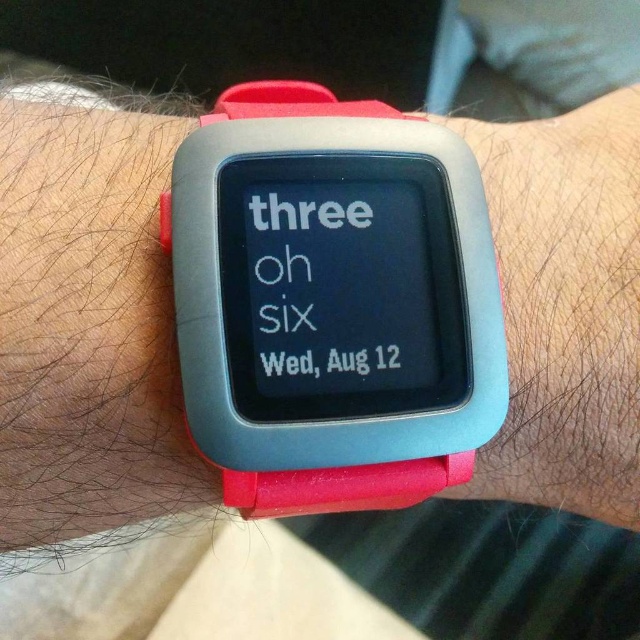
Which is below, rubber watch at center or rubber band at center?

rubber watch at center is below.

Can you confirm if rubber watch at center is taller than rubber band at center?

No.

Which is in front, point (19, 467) or point (540, 186)?

Positioned in front is point (19, 467).

Where is `rubber watch at center`? Image resolution: width=640 pixels, height=640 pixels. rubber watch at center is located at coordinates (88, 326).

Can you confirm if rubberized plastic watch at center is positioned below rubber band at center?

Yes, rubberized plastic watch at center is below rubber band at center.

Is rubberized plastic watch at center behind rubber band at center?

That is False.

Is point (237, 369) in front of point (627, 193)?

Yes, point (237, 369) is closer to viewer.

At what (x,y) coordinates should I click in order to perform the action: click on rubberized plastic watch at center. Please return your answer as a coordinate pair (x, y). The width and height of the screenshot is (640, 640). Looking at the image, I should click on (332, 301).

Is rubberized plastic watch at center positioned behind rubber watch at center?

No, rubberized plastic watch at center is closer to the viewer.

The height and width of the screenshot is (640, 640). Find the location of `rubberized plastic watch at center`. rubberized plastic watch at center is located at coordinates (332, 301).